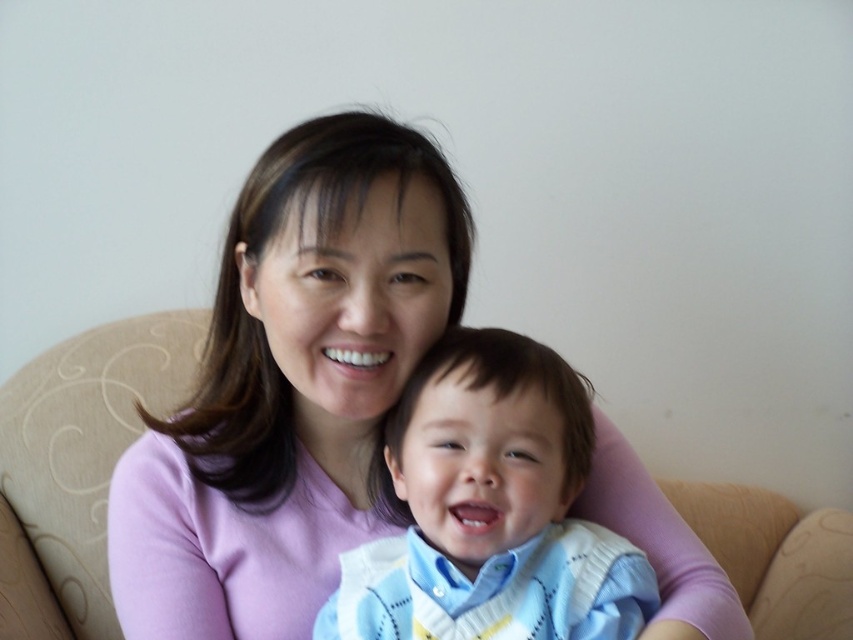
The width and height of the screenshot is (853, 640). Describe the element at coordinates (291, 387) in the screenshot. I see `pink soft sweater at center` at that location.

Between point (228, 280) and point (425, 429), which one is positioned in front?

Point (425, 429)

Find the location of `pink soft sweater at center`. pink soft sweater at center is located at coordinates click(291, 387).

Locate an element on the screen. The height and width of the screenshot is (640, 853). pink soft sweater at center is located at coordinates point(291,387).